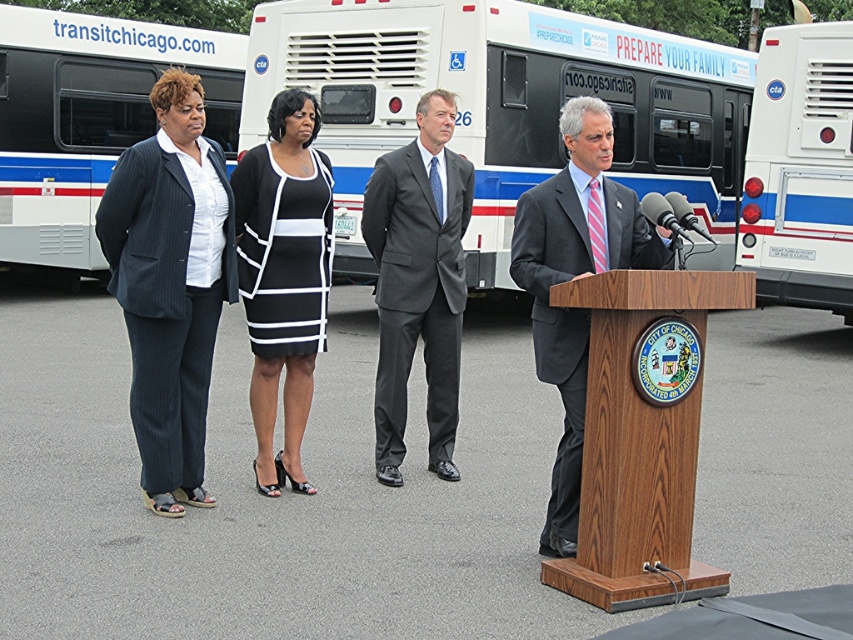
Question: Which object is positioned farthest from the matte gray suit at center?

Choices:
 (A) dark gray pinstripe pantsuit at left
 (B) black and white striped dress at center
 (C) white plastic bus at right
 (D) white plastic bus at left

Answer: (D)

Question: Estimate the real-world distances between objects in this image. Which object is closer to the matte gray suit at center?

Choices:
 (A) wooden podium at center
 (B) white plastic bus at right

Answer: (A)

Question: Which of the following is the closest to the observer?

Choices:
 (A) pyautogui.click(x=743, y=253)
 (B) pyautogui.click(x=9, y=221)

Answer: (A)

Question: Does wooden podium at center appear on the left side of matte gray suit at center?

Choices:
 (A) no
 (B) yes

Answer: (A)

Question: Is white/blue/red bus at upper center closer to camera compared to matte gray suit at center?

Choices:
 (A) yes
 (B) no

Answer: (B)

Question: Can you confirm if white plastic bus at left is thinner than dark gray suit at center?

Choices:
 (A) no
 (B) yes

Answer: (A)